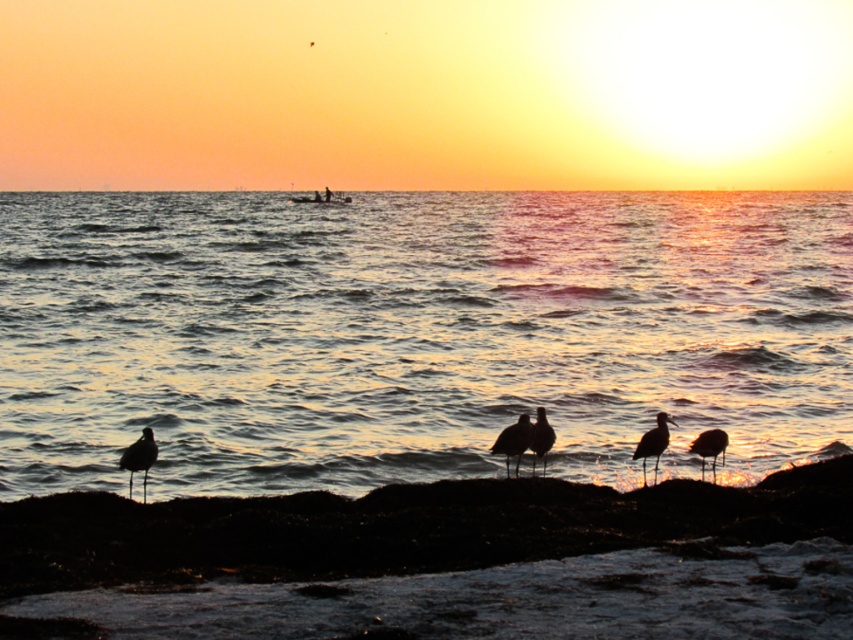
Question: Estimate the real-world distances between objects in this image. Which object is farther from the silvery feathered bird at center?

Choices:
 (A) silhouette feathered bird at lower left
 (B) silvery metallic bird at lower right
 (C) shiny metallic water at center

Answer: (C)

Question: Observing the image, what is the correct spatial positioning of shiny metallic water at center in reference to silhouette feathered bird at lower left?

Choices:
 (A) right
 (B) left

Answer: (A)

Question: Is shiny metallic water at center above silvery metallic seagull at lower right?

Choices:
 (A) no
 (B) yes

Answer: (B)

Question: Is shiny metallic water at center smaller than silvery metallic seagull at lower right?

Choices:
 (A) yes
 (B) no

Answer: (B)

Question: Among these objects, which one is nearest to the camera?

Choices:
 (A) silhouette feathered bird at center
 (B) silvery metallic bird at lower right
 (C) silvery metallic seagull at lower right

Answer: (C)

Question: Among these points, which one is farthest from the camera?

Choices:
 (A) pyautogui.click(x=651, y=432)
 (B) pyautogui.click(x=148, y=435)
 (C) pyautogui.click(x=519, y=452)

Answer: (A)